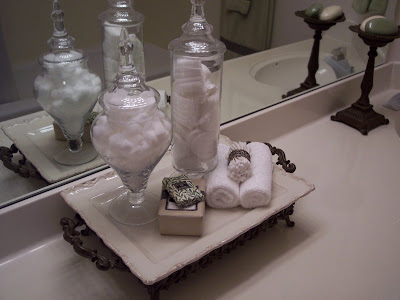
You are a GUI agent. You are given a task and a screenshot of the screen. Output one action in this format:
    pyautogui.click(x=<x>, y=<y>)
    Task: Click on the mirror reflection of green and brown towel
    The height and width of the screenshot is (300, 400).
    Given the screenshot: What is the action you would take?
    pyautogui.click(x=242, y=12)